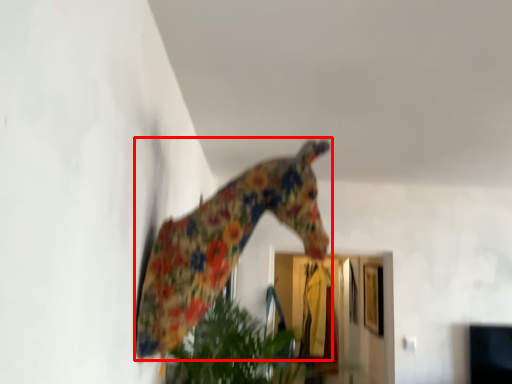
Question: Where is giraffe (annotated by the red box) located in relation to glass door in the image?

Choices:
 (A) left
 (B) right

Answer: (A)